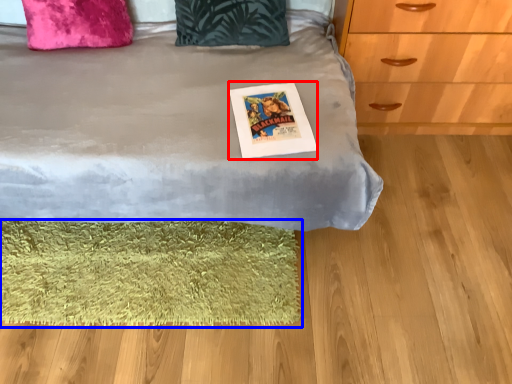
Question: Which of the following is the closest to the observer, postcard (highlighted by a red box) or mat (highlighted by a blue box)?

Choices:
 (A) postcard
 (B) mat

Answer: (A)